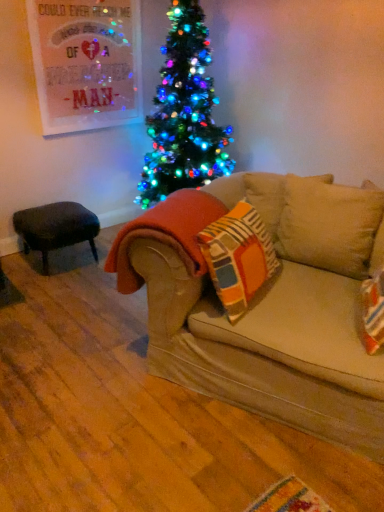
Question: Does orange fleece blanket at center lie in front of beige fabric couch at center?

Choices:
 (A) no
 (B) yes

Answer: (A)

Question: Is orange fleece blanket at center located outside beige fabric couch at center?

Choices:
 (A) yes
 (B) no

Answer: (A)

Question: From a real-world perspective, is orange fleece blanket at center beneath beige fabric couch at center?

Choices:
 (A) yes
 (B) no

Answer: (B)

Question: Does orange fleece blanket at center have a greater height compared to beige fabric couch at center?

Choices:
 (A) yes
 (B) no

Answer: (A)

Question: Can you confirm if orange fleece blanket at center is shorter than beige fabric couch at center?

Choices:
 (A) yes
 (B) no

Answer: (B)

Question: From the image's perspective, does orange fleece blanket at center appear lower than beige fabric couch at center?

Choices:
 (A) yes
 (B) no

Answer: (B)

Question: Is beige fabric couch at center not inside orange fleece blanket at center?

Choices:
 (A) no
 (B) yes

Answer: (B)

Question: From the image's perspective, is beige fabric couch at center located above orange fleece blanket at center?

Choices:
 (A) yes
 (B) no

Answer: (B)

Question: Considering the relative sizes of beige fabric couch at center and orange fleece blanket at center in the image provided, is beige fabric couch at center smaller than orange fleece blanket at center?

Choices:
 (A) yes
 (B) no

Answer: (B)

Question: Is beige fabric couch at center in front of orange fleece blanket at center?

Choices:
 (A) no
 (B) yes

Answer: (B)

Question: Does beige fabric couch at center lie behind orange fleece blanket at center?

Choices:
 (A) no
 (B) yes

Answer: (A)

Question: From a real-world perspective, is beige fabric couch at center positioned over orange fleece blanket at center based on gravity?

Choices:
 (A) yes
 (B) no

Answer: (B)

Question: Does velvet dark brown stool at left touch beige fabric couch at center?

Choices:
 (A) no
 (B) yes

Answer: (A)